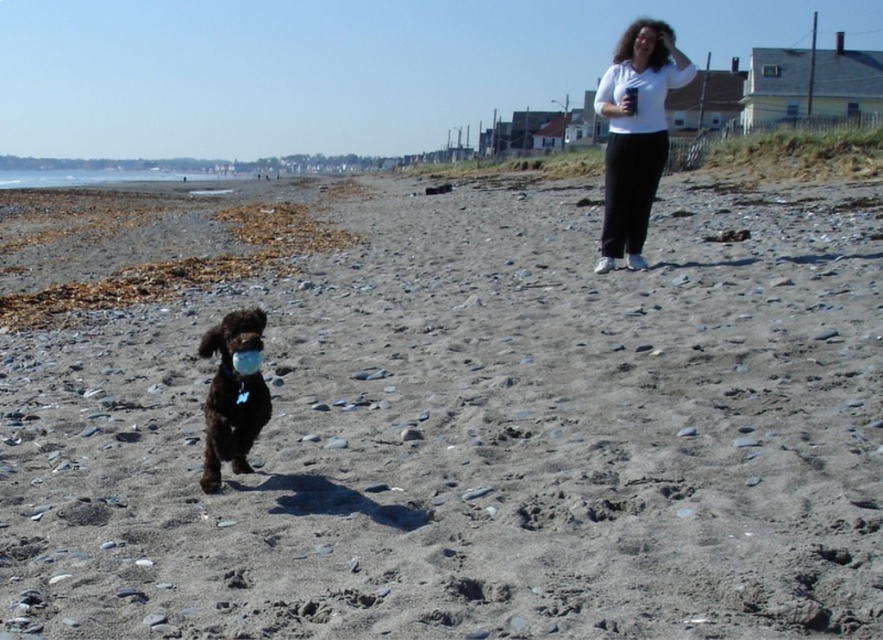
You are a photographer trying to capture the scene of the dog and the person. You notice the white cotton shirt at upper right and the matte white mouth at upper center. Which object should you focus on if you want to capture the larger white area in your photo?

The white cotton shirt at upper right is larger in size than the matte white mouth at upper center, so you should focus on the white cotton shirt at upper right to capture the larger white area in your photo.

Based on the photo, you are standing on the beach and see two points marked on the sand. The first point is at coordinate point(x=306, y=602) and the second is at point(x=243, y=456). If you walk from the first point towards the second, will you be moving away from the dog or towards it?

The dog is running towards the camera. Since point(x=306, y=602) is in front of point(x=243, y=456), moving from the first to the second point means moving backward away from the direction the dog is facing. Therefore, you would be moving away from the dog.

You are a photographer trying to capture the perfect shot of the white cotton shirt at upper right and the matte white mouth at upper center. Which object should you focus on first to ensure it appears larger in your photo?

The white cotton shirt at upper right is much taller than the matte white mouth at upper center, so focusing on the white cotton shirt at upper right will ensure it appears larger in the photo.